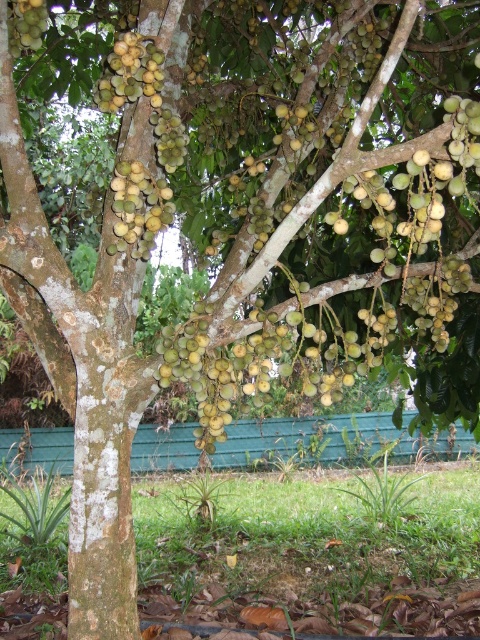
You are standing in front of the tree and want to pick a fruit. Which fruit, the green matte fruit at center or the green matte fruit at upper left, is easier to reach?

The green matte fruit at center is closer to the viewer, so it is easier to reach than the green matte fruit at upper left.